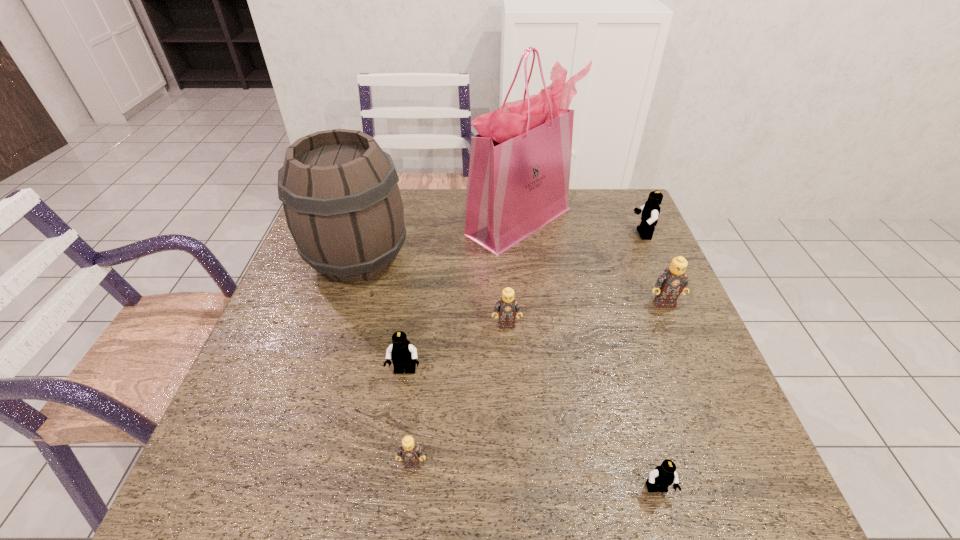
Locate an element on the screen. free space between the fifth nearest object and the fourth nearest Lego is located at coordinates (586, 313).

You are a GUI agent. You are given a task and a screenshot of the screen. Output one action in this format:
    pyautogui.click(x=<x>, y=<y>)
    Task: Click on the vacant space in between the smallest black Lego and the rightmost tan Lego
    This screenshot has width=960, height=540.
    Given the screenshot: What is the action you would take?
    pyautogui.click(x=660, y=396)

I want to click on free space between the third farthest Lego and the second nearest Lego, so 460,394.

Where is `free spot between the wine bucket and the smallest black Lego`? The width and height of the screenshot is (960, 540). free spot between the wine bucket and the smallest black Lego is located at coordinates (508, 374).

Locate an element on the screen. free area in between the fifth farthest object and the fifth farthest Lego is located at coordinates click(460, 394).

Identify which object is the fifth closest to the farthest black Lego. Please provide its 2D coordinates. Your answer should be formatted as a tuple, i.e. [(x, y)], where the tuple contains the x and y coordinates of a point satisfying the conditions above.

[(663, 476)]

Choose which object is the seventh nearest neighbor to the farthest black Lego. Please provide its 2D coordinates. Your answer should be formatted as a tuple, i.e. [(x, y)], where the tuple contains the x and y coordinates of a point satisfying the conditions above.

[(411, 453)]

Choose which Lego is the fourth nearest neighbor to the second nearest tan Lego. Please provide its 2D coordinates. Your answer should be formatted as a tuple, i.e. [(x, y)], where the tuple contains the x and y coordinates of a point satisfying the conditions above.

[(663, 476)]

Select which Lego appears as the third closest to the wine bucket. Please provide its 2D coordinates. Your answer should be formatted as a tuple, i.e. [(x, y)], where the tuple contains the x and y coordinates of a point satisfying the conditions above.

[(411, 453)]

Select which black Lego appears as the second closest to the sixth farthest object. Please provide its 2D coordinates. Your answer should be formatted as a tuple, i.e. [(x, y)], where the tuple contains the x and y coordinates of a point satisfying the conditions above.

[(650, 211)]